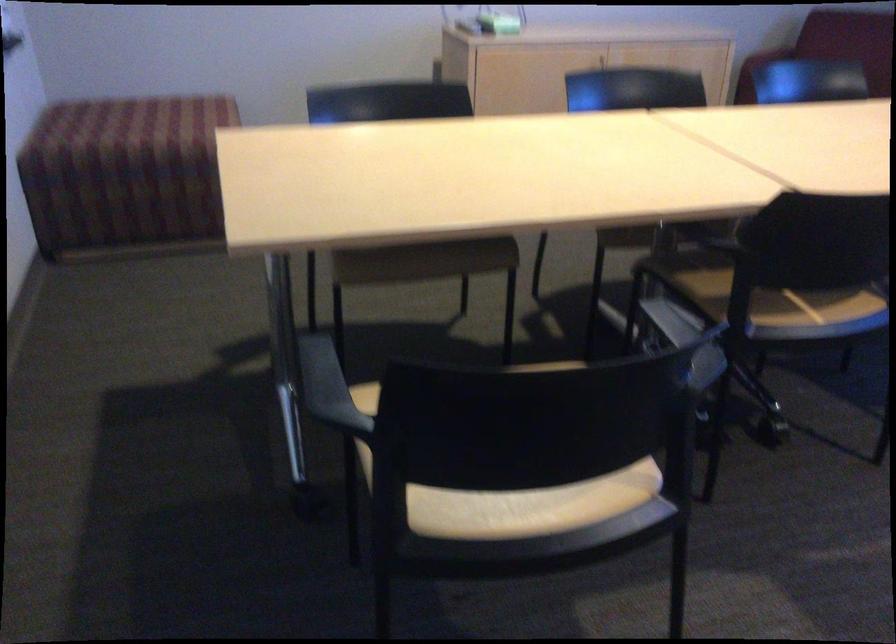
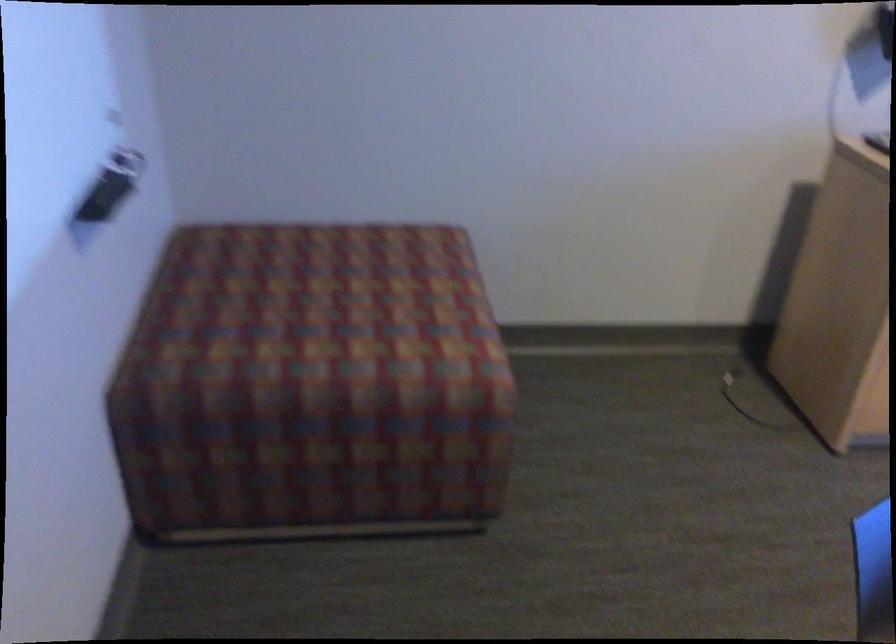
The point at (119,124) is marked in the first image. Where is the corresponding point in the second image?

(332, 301)